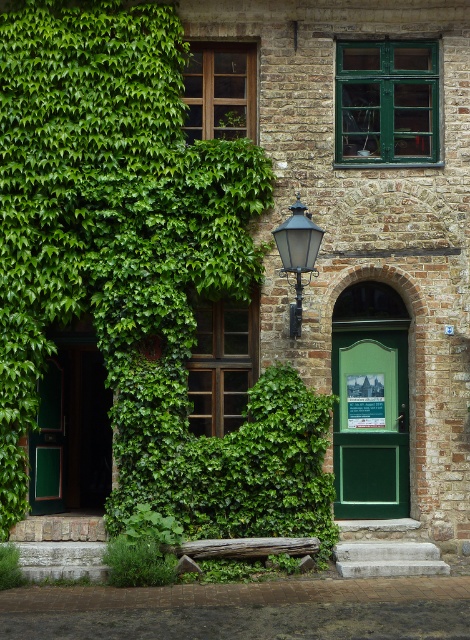
Question: Which of the following is the farthest from the observer?

Choices:
 (A) green matte door at center
 (B) green leafy plant at lower left
 (C) matte black lamp post at center
 (D) green matte door at left

Answer: (A)

Question: Which of the following is the farthest from the observer?

Choices:
 (A) (6, 580)
 (B) (352, 515)
 (C) (29, 448)

Answer: (C)

Question: Does green matte door at center come behind green leafy plant at lower center?

Choices:
 (A) no
 (B) yes

Answer: (B)

Question: Is matte black lamp post at center wider than green leafy plant at lower center?

Choices:
 (A) yes
 (B) no

Answer: (B)

Question: From the image, what is the correct spatial relationship of matte black lamp post at center in relation to green leafy plant at lower left?

Choices:
 (A) below
 (B) above

Answer: (B)

Question: Which object is closer to the camera taking this photo?

Choices:
 (A) green leafy plant at lower left
 (B) green leafy plant at lower center
 (C) green matte door at center

Answer: (B)